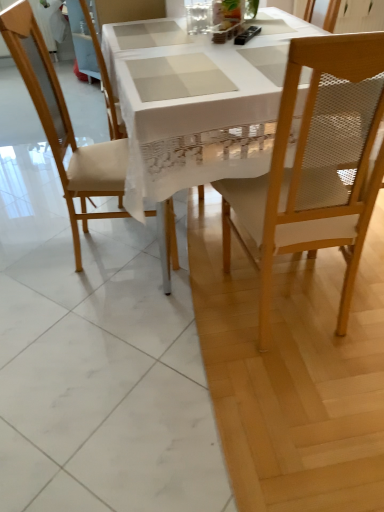
Question: Is white lace tablecloth at center not inside matte wood chair at left, which is the first chair from left to right?

Choices:
 (A) yes
 (B) no

Answer: (A)

Question: Considering the relative positions of white lace tablecloth at center and matte wood chair at left, placed as the 3th chair when sorted from right to left, in the image provided, is white lace tablecloth at center to the left of matte wood chair at left, placed as the 3th chair when sorted from right to left, from the viewer's perspective?

Choices:
 (A) no
 (B) yes

Answer: (A)

Question: Is white lace tablecloth at center not near matte wood chair at left, placed as the 3th chair when sorted from right to left?

Choices:
 (A) no
 (B) yes

Answer: (A)

Question: Is the position of white lace tablecloth at center more distant than that of matte wood chair at left, which is the first chair from left to right?

Choices:
 (A) yes
 (B) no

Answer: (B)

Question: From a real-world perspective, is white lace tablecloth at center positioned over matte wood chair at left, which is the first chair from left to right, based on gravity?

Choices:
 (A) no
 (B) yes

Answer: (A)

Question: Is white lace tablecloth at center bigger than matte wood chair at left, placed as the 3th chair when sorted from right to left?

Choices:
 (A) no
 (B) yes

Answer: (B)

Question: Is light wood mesh chair at right, which is the first chair in right-to-left order, turned away from black plastic remote control at upper center?

Choices:
 (A) yes
 (B) no

Answer: (B)

Question: Does light wood mesh chair at right, placed as the 3th chair when sorted from left to right, have a lesser height compared to black plastic remote control at upper center?

Choices:
 (A) yes
 (B) no

Answer: (B)

Question: From the image's perspective, is light wood mesh chair at right, placed as the 3th chair when sorted from left to right, under black plastic remote control at upper center?

Choices:
 (A) yes
 (B) no

Answer: (A)

Question: Does light wood mesh chair at right, which is the first chair in right-to-left order, have a greater height compared to black plastic remote control at upper center?

Choices:
 (A) yes
 (B) no

Answer: (A)

Question: Is light wood mesh chair at right, which is the first chair in right-to-left order, positioned behind black plastic remote control at upper center?

Choices:
 (A) yes
 (B) no

Answer: (B)

Question: Is light wood mesh chair at right, placed as the 3th chair when sorted from left to right, outside of black plastic remote control at upper center?

Choices:
 (A) yes
 (B) no

Answer: (A)

Question: From the image's perspective, is black plastic remote control at upper center above beige fabric chair at center, which is the second chair from left to right?

Choices:
 (A) yes
 (B) no

Answer: (A)